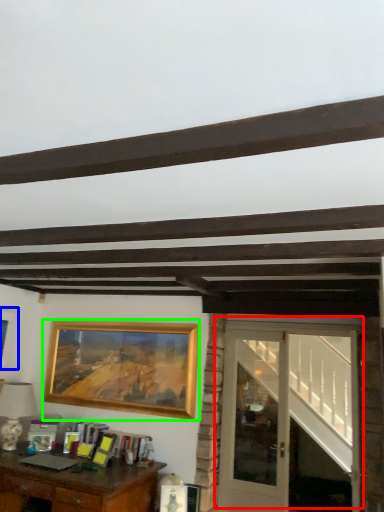
Question: Which object is positioned closest to door (highlighted by a red box)? Select from picture frame (highlighted by a blue box) and picture frame (highlighted by a green box).

Choices:
 (A) picture frame
 (B) picture frame

Answer: (B)